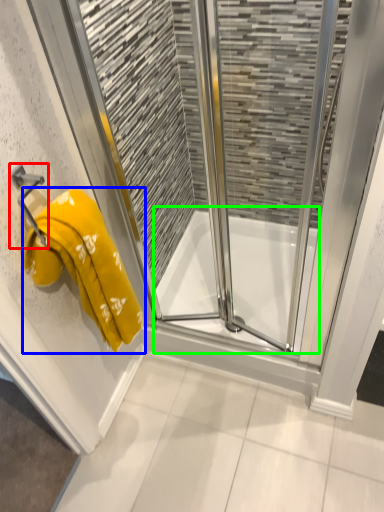
Question: Which object is the farthest from towel bar (highlighted by a red box)? Choose among these: towel (highlighted by a blue box) or bath (highlighted by a green box).

Choices:
 (A) towel
 (B) bath

Answer: (B)